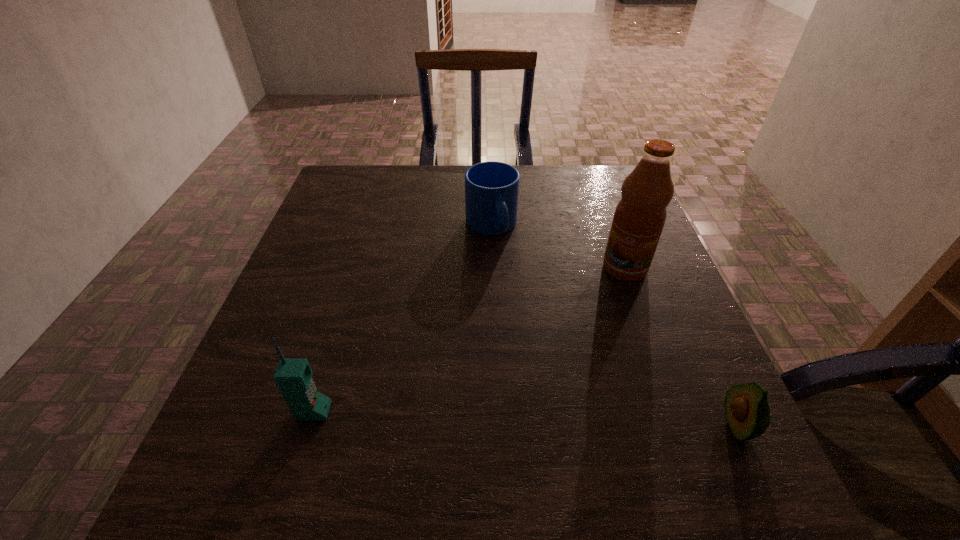
Find the location of a particular element. This screenshot has width=960, height=540. vacant space located 0.180m on the cut side of the rightmost object is located at coordinates (615, 426).

Image resolution: width=960 pixels, height=540 pixels. In order to click on vacant space located on the label side of the tallest object in this screenshot , I will do `click(558, 362)`.

Where is `vacant point located 0.150m on the label side of the tallest object`? The width and height of the screenshot is (960, 540). vacant point located 0.150m on the label side of the tallest object is located at coordinates (588, 320).

Where is `vacant region located 0.110m on the label side of the tallest object`? vacant region located 0.110m on the label side of the tallest object is located at coordinates (595, 309).

Find the location of a particular element. free space located on the side of the mug with the handle is located at coordinates (540, 335).

Locate an element on the screen. vacant space located 0.320m on the side of the mug with the handle is located at coordinates (545, 346).

The height and width of the screenshot is (540, 960). In order to click on vacant region located on the side of the mug with the handle in this screenshot , I will do `click(549, 354)`.

At what (x,y) coordinates should I click in order to perform the action: click on object at the far edge. Please return your answer as a coordinate pair (x, y). The height and width of the screenshot is (540, 960). Looking at the image, I should click on (491, 188).

Identify the location of cellular telephone that is at the near edge. pos(293,376).

Where is `avocado present at the near edge`? Image resolution: width=960 pixels, height=540 pixels. avocado present at the near edge is located at coordinates (747, 411).